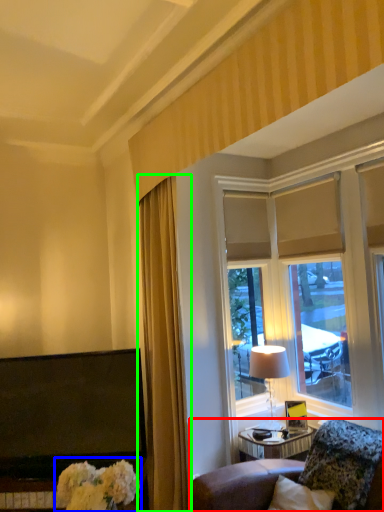
Question: Which object is positioned closest to furniture (highlighted by a red box)? Select from floral arrangement (highlighted by a blue box) and curtain (highlighted by a green box).

Choices:
 (A) floral arrangement
 (B) curtain

Answer: (B)